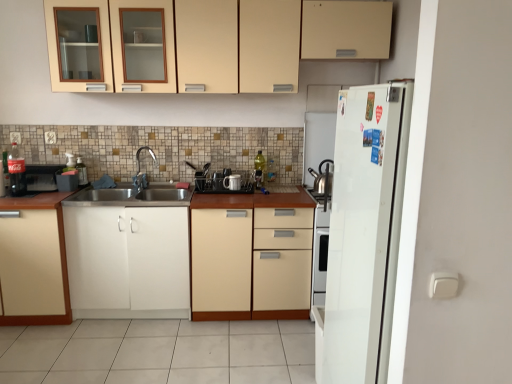
Image resolution: width=512 pixels, height=384 pixels. Find the location of `free space in front of white glossy mug at center, which is the 2th appliance in right-to-left order`. free space in front of white glossy mug at center, which is the 2th appliance in right-to-left order is located at coordinates pyautogui.click(x=229, y=196).